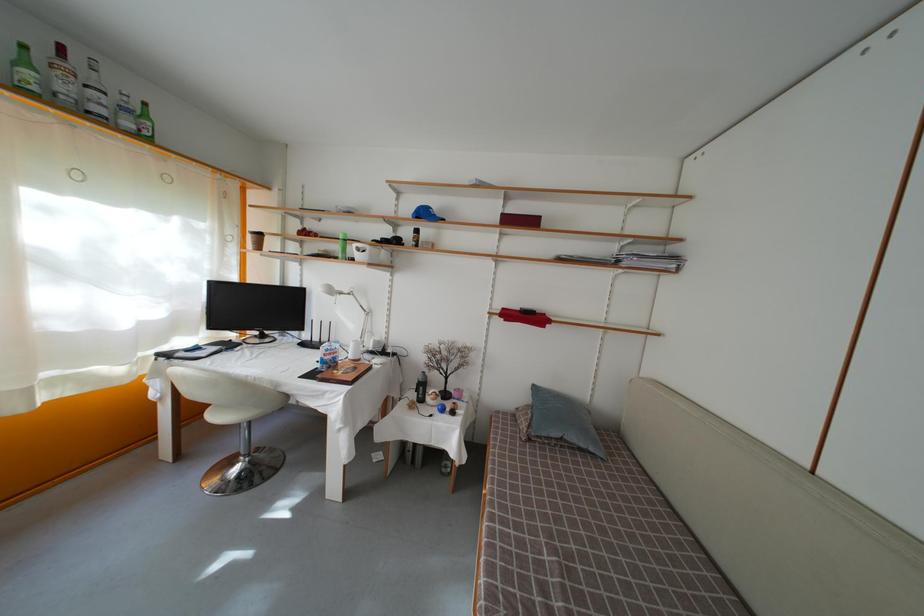
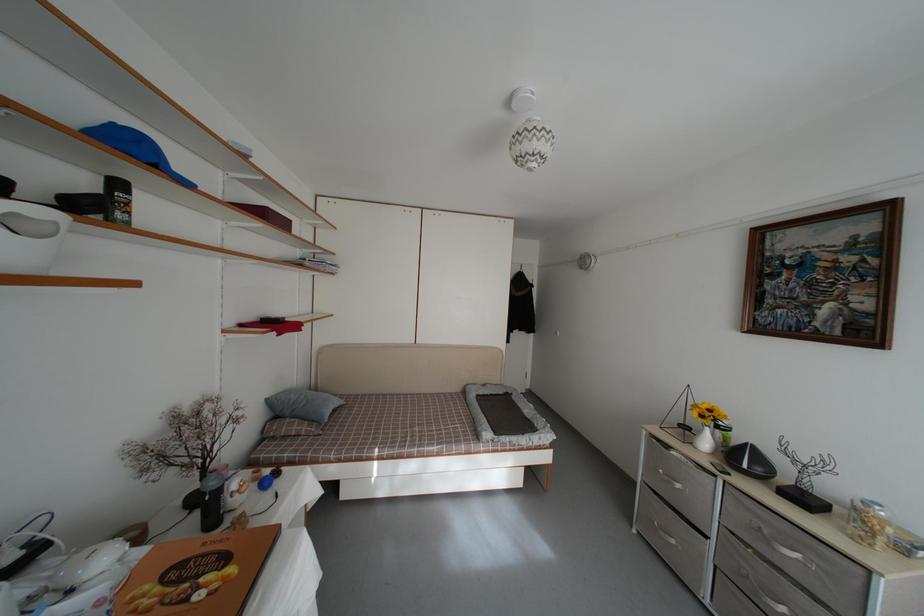
In the second image, find the point that corresponds to (x=550, y=450) in the first image.

(332, 431)